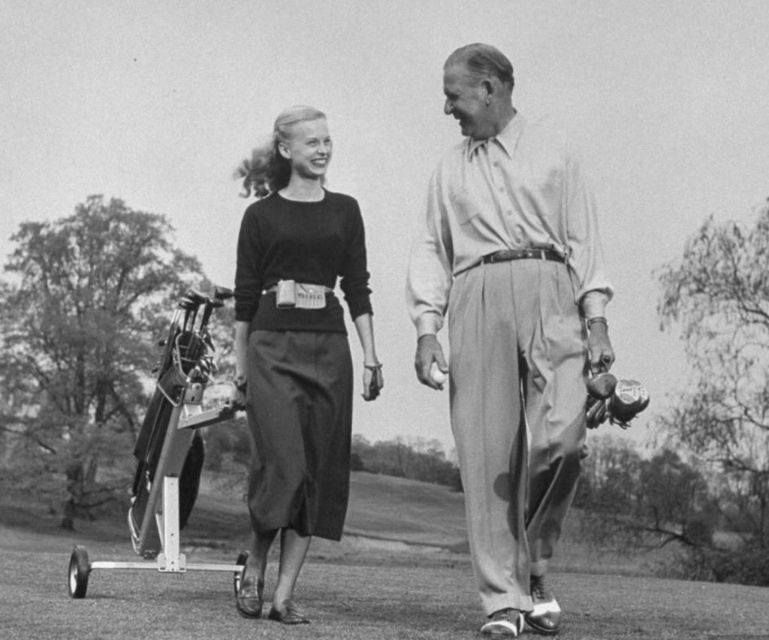
You are a fashion designer analyzing the clothing items in the image. Which clothing item, the light beige cotton pants at center or the matte black sweater at center, is shorter in length?

The light beige cotton pants at center has a lesser height compared to matte black sweater at center, so the light beige cotton pants at center is shorter in length.

You are a photographer trying to capture a closeup of the light beige cotton pants at center and the matte black sweater at center. Which one should you zoom in on first to ensure both are in focus?

The light beige cotton pants at center has a smaller size compared to matte black sweater at center, so you should zoom in on the light beige cotton pants at center first to ensure both are in focus.

You are a fashion designer observing the two people in the image. You notice the light beige cotton pants at center and the matte black sweater at center. Which clothing item is positioned higher on the person?

The light beige cotton pants at center are located above the matte black sweater at center, so the light beige cotton pants at center are positioned higher on the person.